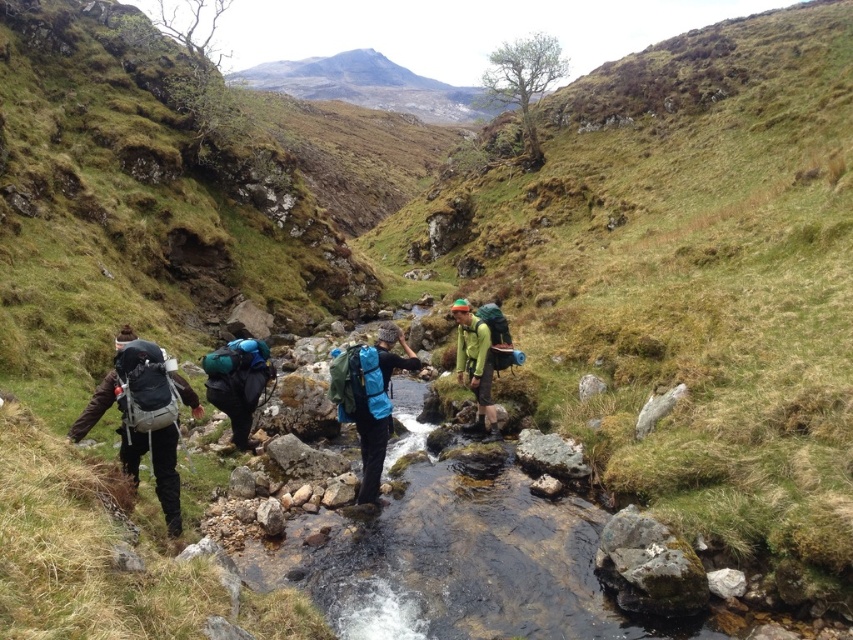
Question: Which point is farther to the camera?

Choices:
 (A) green matte jacket at center
 (B) matte blue backpack at center
 (C) blue fabric backpack at center

Answer: (A)

Question: Which point is closer to the camera?

Choices:
 (A) (381, 380)
 (B) (157, 451)
 (C) (461, 314)
 (D) (262, 390)

Answer: (B)

Question: Observing the image, what is the correct spatial positioning of blue fabric backpack at center in reference to matte blue backpack at center?

Choices:
 (A) above
 (B) below

Answer: (A)

Question: Which object is positioned closest to the matte blue backpack at center?

Choices:
 (A) green matte jacket at center
 (B) blue fabric backpack at center
 (C) matte black backpack at left

Answer: (B)

Question: Does blue fabric backpack at center come behind green matte jacket at center?

Choices:
 (A) no
 (B) yes

Answer: (A)

Question: Can you confirm if matte black backpack at left is bigger than matte blue backpack at center?

Choices:
 (A) no
 (B) yes

Answer: (A)